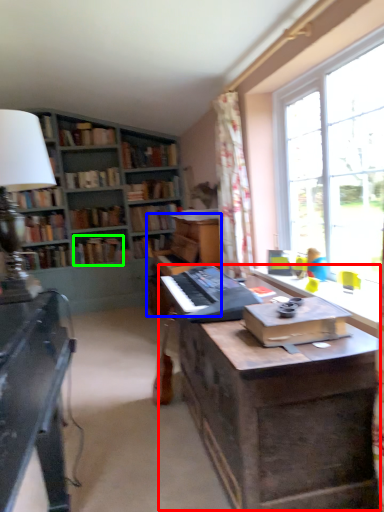
Question: Which is farther away from table (highlighted by a red box)? piano (highlighted by a blue box) or book (highlighted by a green box)?

Choices:
 (A) piano
 (B) book

Answer: (B)